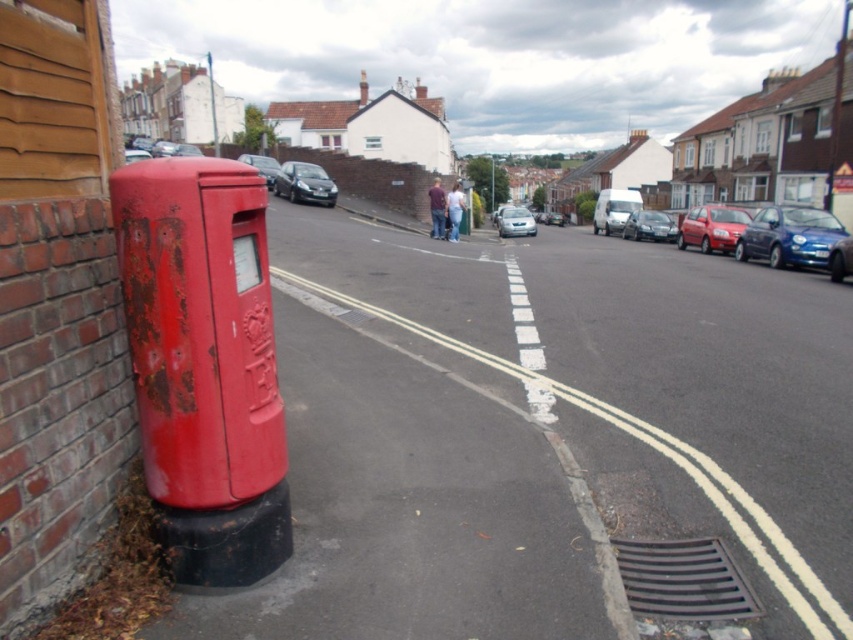
Question: Is rusty metal mailbox at left positioned behind metallic blue car at right?

Choices:
 (A) no
 (B) yes

Answer: (A)

Question: Among these points, which one is farthest from the camera?

Choices:
 (A) (842, 77)
 (B) (784, 228)

Answer: (A)

Question: Among these objects, which one is nearest to the camera?

Choices:
 (A) rusty metal mailbox at left
 (B) shiny metallic sedan at center
 (C) metallic silver car at center

Answer: (A)

Question: Does shiny metallic car at center have a lesser width compared to shiny metallic sedan at center?

Choices:
 (A) no
 (B) yes

Answer: (B)

Question: Is rusty metal mailbox at left in front of metallic silver car at center?

Choices:
 (A) yes
 (B) no

Answer: (A)

Question: Which point is farther from the camera taking this photo?

Choices:
 (A) (253, 547)
 (B) (210, 61)

Answer: (B)